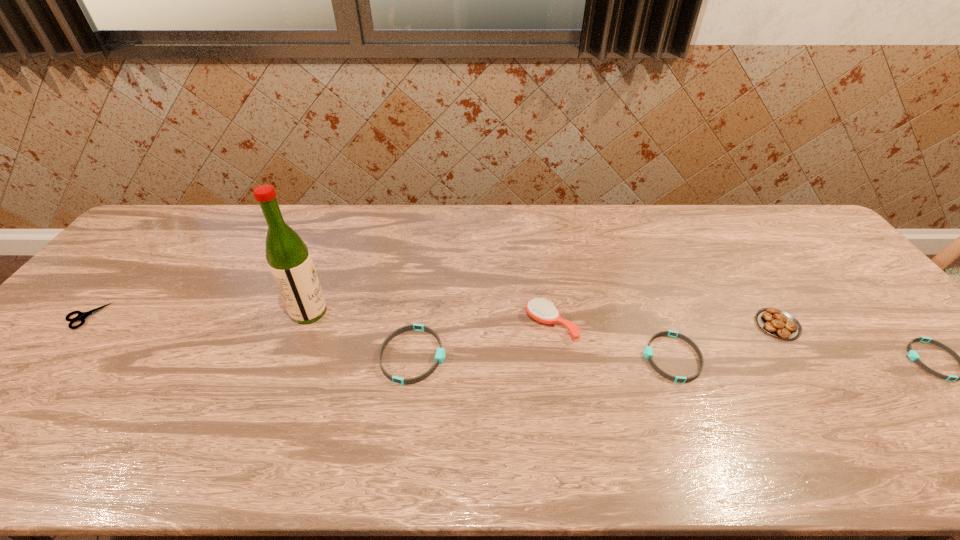
The image size is (960, 540). I want to click on free space between the third object from left to right and the fifth tallest object, so click(x=542, y=356).

Choose which object is the fifth nearest neighbor to the shortest wristband. Please provide its 2D coordinates. Your answer should be formatted as a tuple, i.e. [(x, y)], where the tuple contains the x and y coordinates of a point satisfying the conditions above.

[(289, 260)]

Identify which object is the fourth closest to the third object from left to right. Please provide its 2D coordinates. Your answer should be formatted as a tuple, i.e. [(x, y)], where the tuple contains the x and y coordinates of a point satisfying the conditions above.

[(81, 316)]

At what (x,y) coordinates should I click in order to perform the action: click on wristband that is the second closest to the leftmost object. Please return your answer as a coordinate pair (x, y). Image resolution: width=960 pixels, height=540 pixels. Looking at the image, I should click on (648, 351).

Locate which wristband is the closest to the third tallest object. Please provide its 2D coordinates. Your answer should be formatted as a tuple, i.e. [(x, y)], where the tuple contains the x and y coordinates of a point satisfying the conditions above.

[(648, 351)]

Find the location of a particular element. This screenshot has width=960, height=540. vacant area in the image that satisfies the following two spatial constraints: 1. on the back side of the fourth object from left to right; 2. on the label of the tallest object is located at coordinates (549, 312).

This screenshot has height=540, width=960. Find the location of `vacant position in the image that satisfies the following two spatial constraints: 1. on the label of the liquor; 2. on the right side of the hairbrush`. vacant position in the image that satisfies the following two spatial constraints: 1. on the label of the liquor; 2. on the right side of the hairbrush is located at coordinates (304, 325).

You are a GUI agent. You are given a task and a screenshot of the screen. Output one action in this format:
    pyautogui.click(x=<x>, y=<y>)
    Task: Click on the free location that satisfies the following two spatial constraints: 1. on the label of the tallest object; 2. on the front side of the shears
    Image resolution: width=960 pixels, height=540 pixels.
    Given the screenshot: What is the action you would take?
    pyautogui.click(x=307, y=316)

What are the coordinates of `vacant region that satisfies the following two spatial constraints: 1. on the label of the sixth object from right to left; 2. on the front side of the shortest object` in the screenshot? It's located at (307, 316).

Locate an element on the screen. This screenshot has width=960, height=540. free space that satisfies the following two spatial constraints: 1. on the front side of the hairbrush; 2. on the buckle of the third object from left to right is located at coordinates (556, 355).